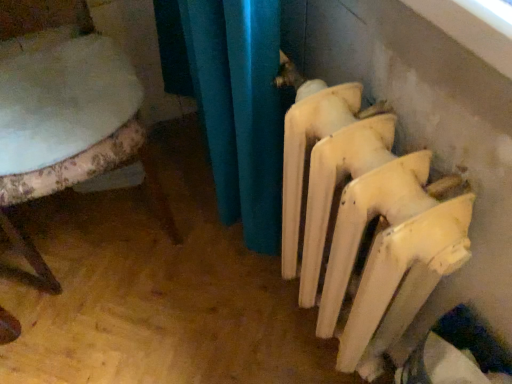
Find the location of `vacant area to the right of white fabric chair at left`. vacant area to the right of white fabric chair at left is located at coordinates (206, 223).